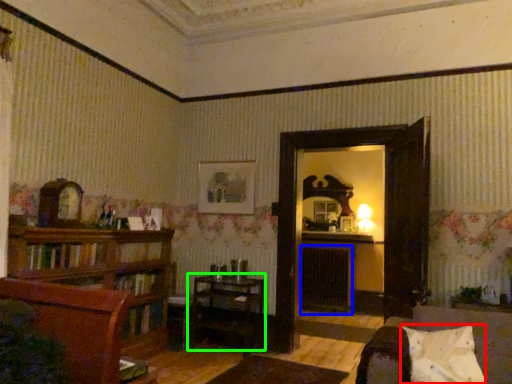
Question: Based on their relative distances, which object is farther from pillow (highlighted by a red box)? Choose from fireplace (highlighted by a blue box) and table (highlighted by a green box).

Choices:
 (A) fireplace
 (B) table

Answer: (A)